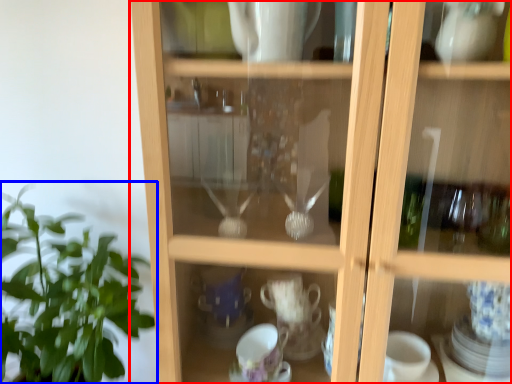
Question: Which object is further to the camera taking this photo, cupboard (highlighted by a red box) or houseplant (highlighted by a blue box)?

Choices:
 (A) cupboard
 (B) houseplant

Answer: (B)